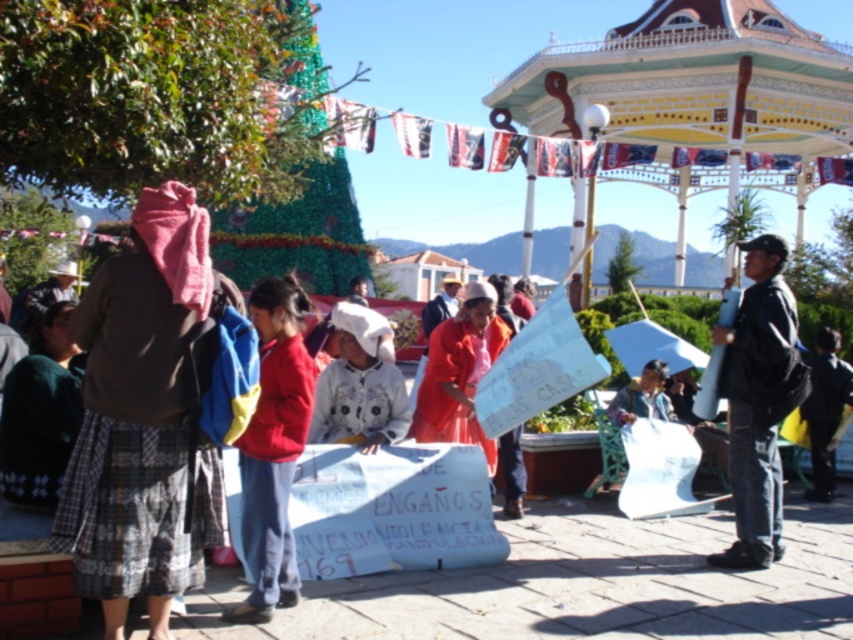
Identify the location of red fabric jacket at center. This screenshot has height=640, width=853. (273, 448).

Between point (259, 518) and point (805, 404), which one is positioned behind?

The point (805, 404) is more distant.

Describe the element at coordinates (273, 448) in the screenshot. I see `red fabric jacket at center` at that location.

This screenshot has width=853, height=640. Find the location of `red fabric jacket at center`. red fabric jacket at center is located at coordinates click(273, 448).

Between plaid fabric skirt at left and decorative painted wood gazebo at upper right, which one appears on the left side from the viewer's perspective?

From the viewer's perspective, plaid fabric skirt at left appears more on the left side.

Who is taller, plaid fabric skirt at left or decorative painted wood gazebo at upper right?

With more height is decorative painted wood gazebo at upper right.

Where is `plaid fabric skirt at left`? The height and width of the screenshot is (640, 853). plaid fabric skirt at left is located at coordinates click(x=142, y=417).

Which is more to the right, plaid fabric skirt at left or dark blue jacket at center?

Positioned to the right is dark blue jacket at center.

Between point (123, 592) and point (845, 369), which one is positioned in front?

Point (123, 592) is in front.

Which is behind, point (163, 355) or point (824, 410)?

The point (824, 410) is more distant.

Where is `plaid fabric skirt at left`? plaid fabric skirt at left is located at coordinates (142, 417).